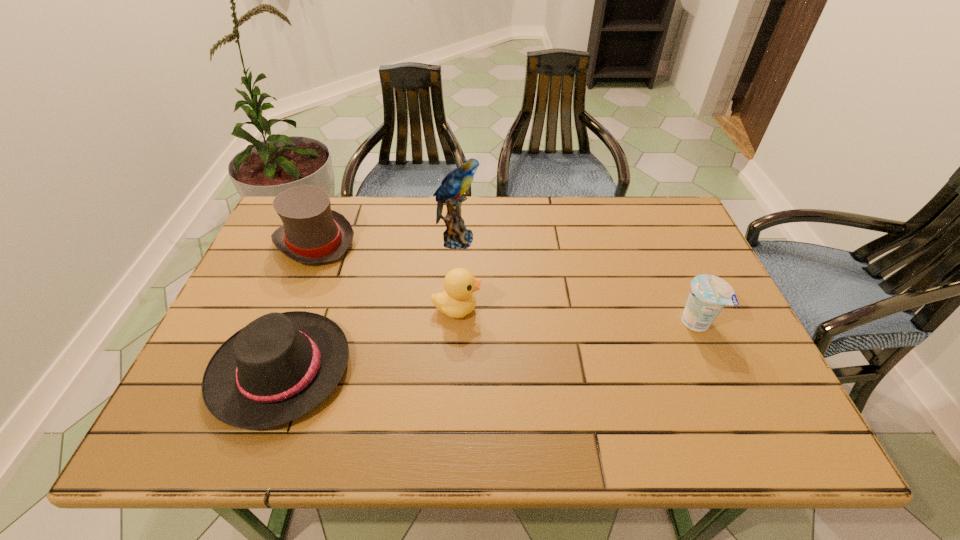
Find the location of a particular element. unoccupied area between the rightmost object and the taller dress hat is located at coordinates (506, 282).

Find the location of a particular element. This screenshot has width=960, height=540. object that is the fourth closest to the duck is located at coordinates (709, 294).

Identify which object is located as the second nearest to the duck. Please provide its 2D coordinates. Your answer should be formatted as a tuple, i.e. [(x, y)], where the tuple contains the x and y coordinates of a point satisfying the conditions above.

[(456, 236)]

Identify the location of vacant region that satisfies the following two spatial constraints: 1. on the face of the tallest object; 2. on the front side of the nearer dress hat. (450, 369).

The width and height of the screenshot is (960, 540). What are the coordinates of `free point that satisfies the following two spatial constraints: 1. on the face of the parrot; 2. on the left side of the yogurt` in the screenshot? It's located at 452,322.

Identify the location of vacant region that satisfies the following two spatial constraints: 1. on the back side of the rightmost object; 2. on the right side of the nearer dress hat. (299, 322).

Where is `vacant space that satisfies the following two spatial constraints: 1. on the back side of the rightmost object; 2. on the face of the duck`? vacant space that satisfies the following two spatial constraints: 1. on the back side of the rightmost object; 2. on the face of the duck is located at coordinates (689, 309).

The image size is (960, 540). I want to click on free spot that satisfies the following two spatial constraints: 1. on the face of the parrot; 2. on the right side of the yogurt, so click(452, 322).

At what (x,y) coordinates should I click in order to perform the action: click on free spot that satisfies the following two spatial constraints: 1. on the face of the parrot; 2. on the front side of the farther dress hat. Please return your answer as a coordinate pair (x, y). Looking at the image, I should click on (457, 241).